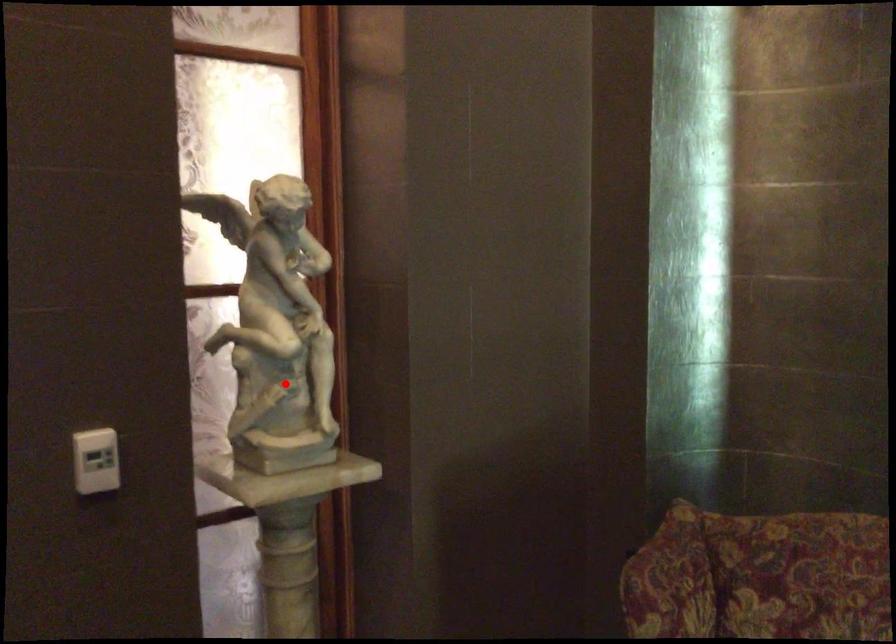
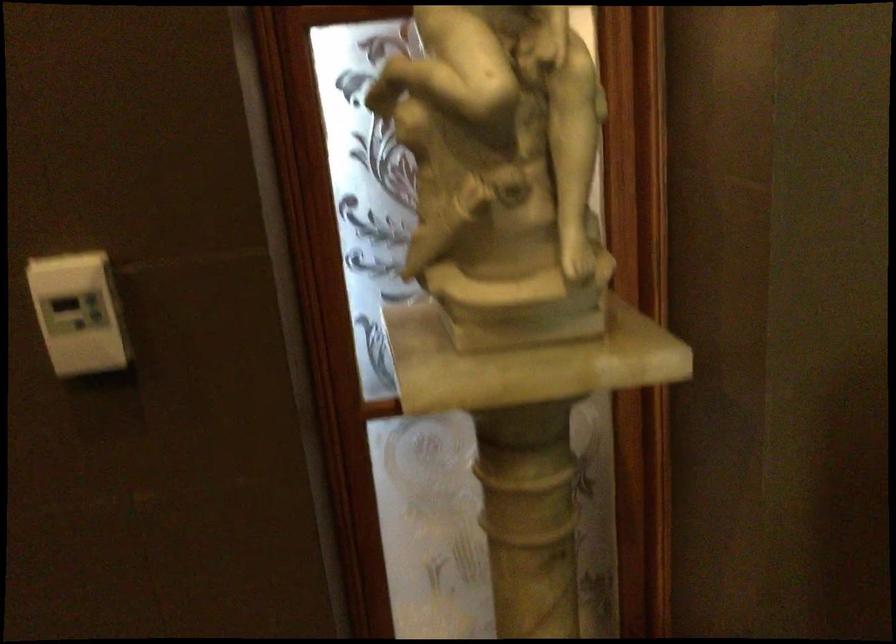
Question: I am providing you with two images of the same scene from different viewpoints. A red point is shown in image1. For the corresponding object point in image2, is it positioned nearer or farther from the camera?

Choices:
 (A) Nearer
 (B) Farther

Answer: (A)